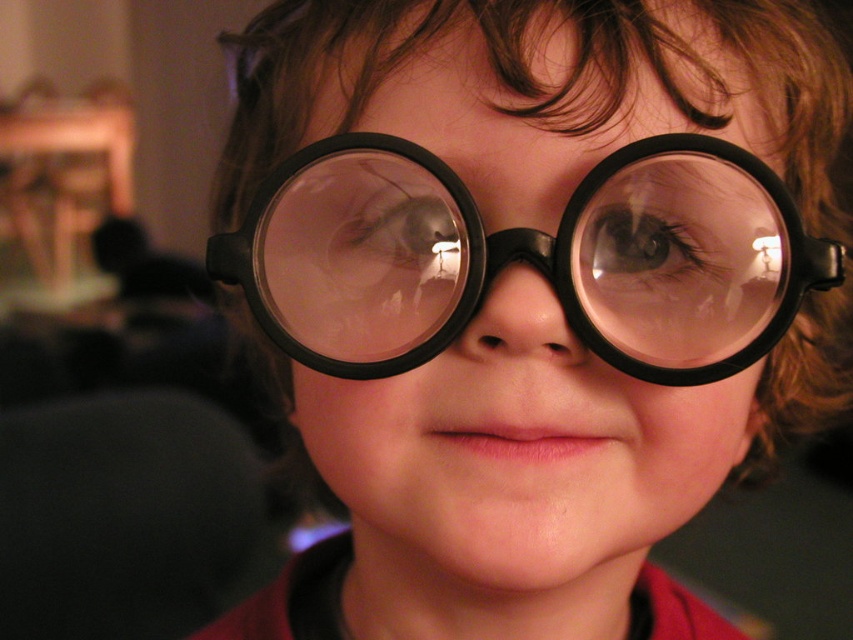
You are a photographer adjusting the lighting in a studio. You notice the black matte goggles at center and the brown matte eye at center in the image. Which object is located lower in the frame?

The black matte goggles at center is positioned under the brown matte eye at center, so it is located lower in the frame.

You are a photographer adjusting the lighting for a portrait. You notice the brown matte eye at center and the translucent plastic eye at center in the image. Which eye is located lower on the child?

The brown matte eye at center is positioned under the translucent plastic eye at center, so it is located lower on the child.